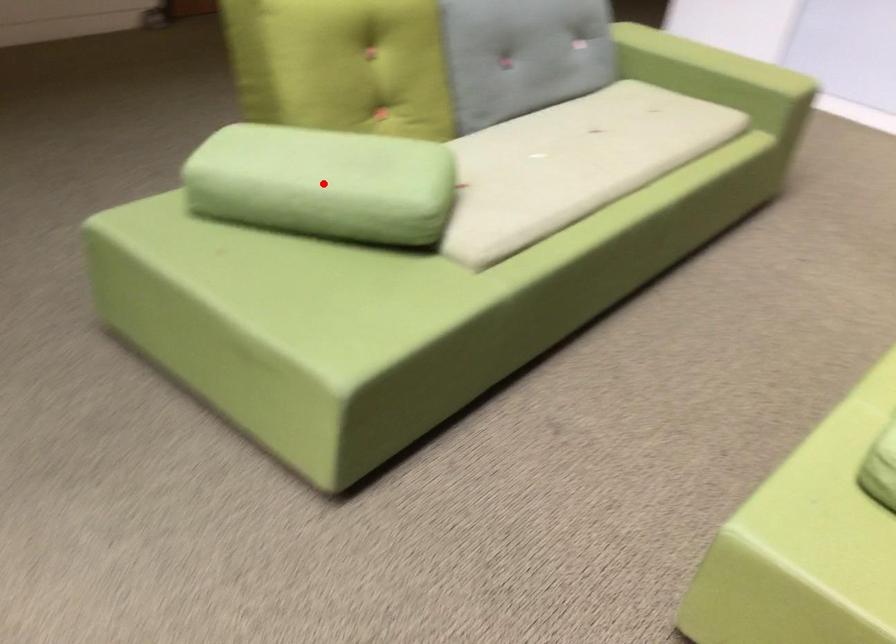
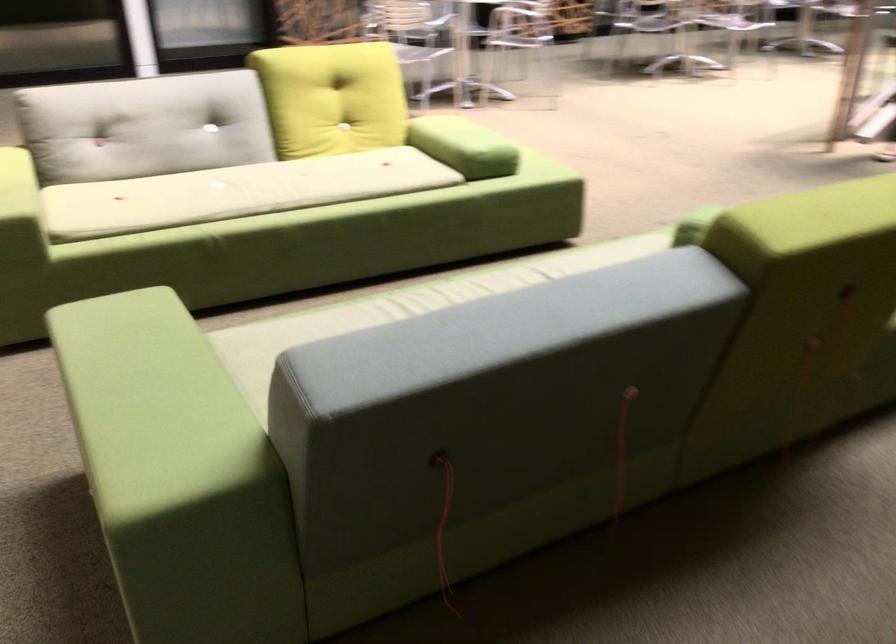
Question: I am providing you with two images of the same scene from different viewpoints. A red point is marked on the first image. At the location where the point appears in image 1, is it still visible in image 2?

Choices:
 (A) Yes
 (B) No

Answer: (B)